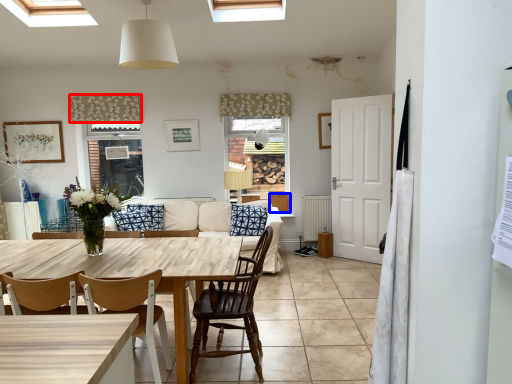
Question: Which of the following is the closest to the observer, curtain (highlighted by a red box) or cabinetry (highlighted by a blue box)?

Choices:
 (A) curtain
 (B) cabinetry

Answer: (A)